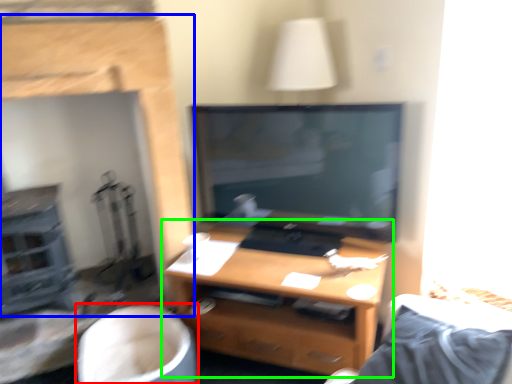
Question: Which object is positioned closest to swivel chair (highlighted by a red box)? Select from fireplace (highlighted by a blue box) and desk (highlighted by a green box).

Choices:
 (A) fireplace
 (B) desk

Answer: (B)